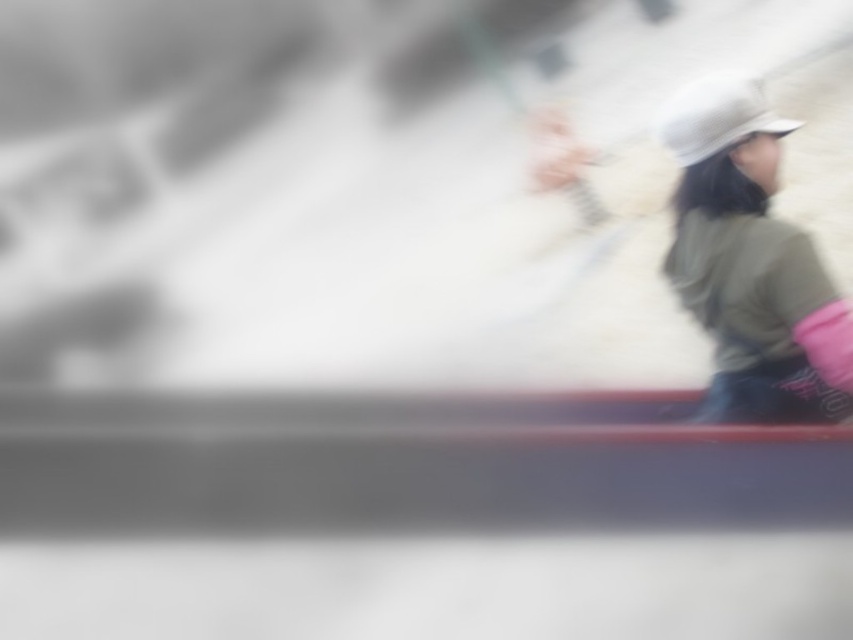
Question: Which object appears farthest from the camera in this image?

Choices:
 (A) khaki cotton hat at right
 (B) white matte hat at upper right

Answer: (B)

Question: Which point is closer to the camera?

Choices:
 (A) click(718, 269)
 (B) click(674, 116)

Answer: (B)

Question: Does khaki cotton hat at right have a smaller size compared to white matte hat at upper right?

Choices:
 (A) no
 (B) yes

Answer: (A)

Question: Can you confirm if khaki cotton hat at right is thinner than white matte hat at upper right?

Choices:
 (A) yes
 (B) no

Answer: (B)

Question: Does khaki cotton hat at right have a larger size compared to white matte hat at upper right?

Choices:
 (A) yes
 (B) no

Answer: (A)

Question: Among these points, which one is farthest from the camera?

Choices:
 (A) (784, 125)
 (B) (722, 144)

Answer: (A)